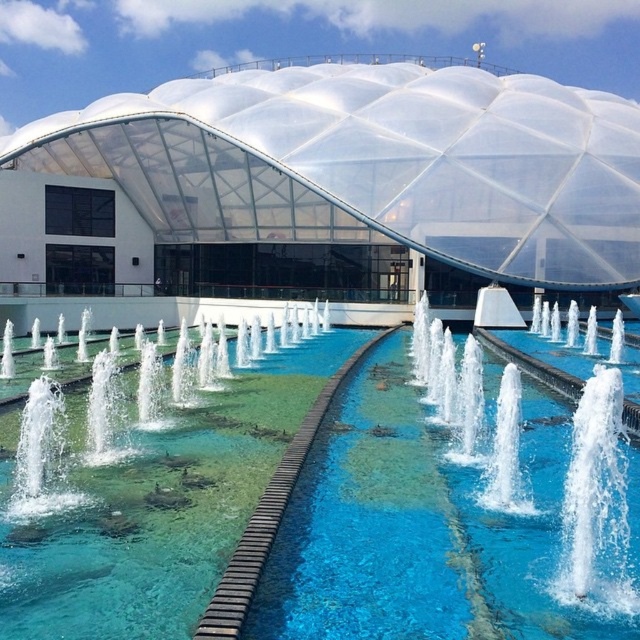
You are a visitor at this modern building and want to take a photo of the clear glass swimming pool at center through the transparent plastic dome at center. Can you see the pool clearly through the dome?

The clear glass swimming pool at center is in front of the transparent plastic dome at center, so the dome is between you and the pool. This may cause some distortion or reflection, making it harder to see the pool clearly through the dome.

Looking at this image, you are standing in front of the modern architectural structure with the geodesic dome. You notice two points marked on the dome surface at coordinates point (x=404, y=518) and point (x=419, y=337). From your perspective, which point is closer to you?

Point (x=404, y=518) is in front of point (x=419, y=337), so it is closer to you.